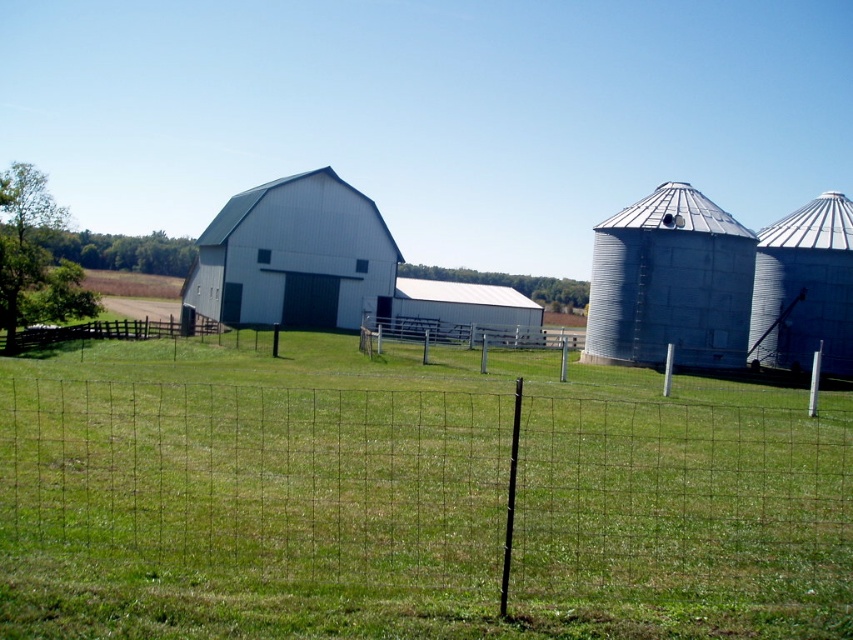
Does point (838, 316) come farther from viewer compared to point (144, 321)?

No, (838, 316) is in front of (144, 321).

Who is taller, silver metallic silo at right or wire mesh fence at lower left?

silver metallic silo at right

The width and height of the screenshot is (853, 640). Describe the element at coordinates (804, 289) in the screenshot. I see `silver metallic silo at right` at that location.

Where is `silver metallic silo at right`? This screenshot has width=853, height=640. silver metallic silo at right is located at coordinates (804, 289).

Can you confirm if metallic silver silo at right is positioned to the left of silver metallic silo at right?

Correct, you'll find metallic silver silo at right to the left of silver metallic silo at right.

Find the location of a particular element. The height and width of the screenshot is (640, 853). metallic silver silo at right is located at coordinates (670, 284).

This screenshot has width=853, height=640. What are the coordinates of `metallic silver silo at right` in the screenshot? It's located at (670, 284).

Is point (422, 316) more distant than point (451, 294)?

No, it is in front of (451, 294).

Can you confirm if white wood barn at center is positioned above white matte barn at center?

Indeed, white wood barn at center is positioned over white matte barn at center.

Is point (300, 220) less distant than point (537, 324)?

Yes, it is.

You are a GUI agent. You are given a task and a screenshot of the screen. Output one action in this format:
    pyautogui.click(x=<x>, y=<y>)
    Task: Click on the white wood barn at center
    The image size is (853, 640).
    Given the screenshot: What is the action you would take?
    pyautogui.click(x=334, y=269)